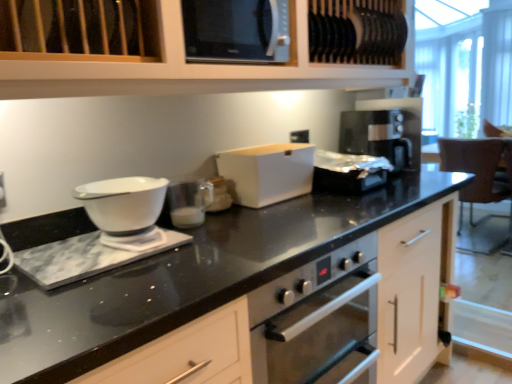
At what (x,y) coordinates should I click in order to perform the action: click on black glossy microwave at upper center. Please return your answer as a coordinate pair (x, y). The image size is (512, 384). Looking at the image, I should click on (236, 30).

Identify the location of silver metallic toaster at center, the 3th appliance viewed from the front. The width and height of the screenshot is (512, 384). (348, 172).

Measure the distance between white glossy bowl at left, which ranks as the second kitchen appliance in right-to-left order, and camera.

white glossy bowl at left, which ranks as the second kitchen appliance in right-to-left order, and camera are 1.06 meters apart from each other.

Find the location of a particular element. white glossy measuring cup at center, which is counted as the 1th appliance, starting from the left is located at coordinates (189, 203).

The height and width of the screenshot is (384, 512). I want to click on matte glass jar at center, positioned as the second appliance in front-to-back order, so click(219, 195).

Is brown leather chair at right directly adjacent to black glossy microwave at upper center?

brown leather chair at right is not next to black glossy microwave at upper center, and they're not touching.

From a real-world perspective, who is located higher, brown leather chair at right or black glossy microwave at upper center?

In real-world perspective, black glossy microwave at upper center is above.

Locate an element on the screen. The width and height of the screenshot is (512, 384). chair behind the black glossy microwave at upper center is located at coordinates (479, 176).

Between point (482, 162) and point (227, 54), which one is positioned behind?

The point (482, 162) is more distant.

Which of these two, silver metallic toaster at center, the 1th appliance from the back, or brown leather chair at right, is smaller?

silver metallic toaster at center, the 1th appliance from the back, is smaller.

From their relative heights in the image, would you say silver metallic toaster at center, the 3th appliance viewed from the front, is taller or shorter than brown leather chair at right?

In the image, silver metallic toaster at center, the 3th appliance viewed from the front, appears to be shorter than brown leather chair at right.

From the picture: From the image's perspective, is silver metallic toaster at center, which is the 1th appliance from right to left, positioned above or below brown leather chair at right?

Clearly, from the image's perspective, silver metallic toaster at center, which is the 1th appliance from right to left, is above brown leather chair at right.

From a real-world perspective, who is located lower, silver metallic toaster at center, which is the 1th appliance from right to left, or brown leather chair at right?

brown leather chair at right.

Is silver metallic toaster at center, the 3th appliance viewed from the front, positioned with its back to white matte breadbox at center, the second kitchen appliance from the left?

No, silver metallic toaster at center, the 3th appliance viewed from the front, is not facing the opposite direction of white matte breadbox at center, the second kitchen appliance from the left.

Can white matte breadbox at center, the second kitchen appliance from the left, be found inside silver metallic toaster at center, the 3th appliance viewed from the front?

No, silver metallic toaster at center, the 3th appliance viewed from the front, does not contain white matte breadbox at center, the second kitchen appliance from the left.

Considering the sizes of objects silver metallic toaster at center, which is the 1th appliance from right to left, and white matte breadbox at center, which ranks as the first kitchen appliance in right-to-left order, in the image provided, who is thinner, silver metallic toaster at center, which is the 1th appliance from right to left, or white matte breadbox at center, which ranks as the first kitchen appliance in right-to-left order,?

white matte breadbox at center, which ranks as the first kitchen appliance in right-to-left order, is thinner.

Is there a large distance between satin black coffee machine at right and silver metallic toaster at center, the 3th appliance viewed from the front?

No.

From a real-world perspective, which object rests below the other?

From a 3D spatial view, silver metallic toaster at center, the 1th appliance from the back, is below.

Between satin black coffee machine at right and silver metallic toaster at center, which is the 1th appliance from right to left, which one has smaller width?

silver metallic toaster at center, which is the 1th appliance from right to left, is thinner.

From the picture: In the image, is satin black coffee machine at right on the left side or the right side of white matte breadbox at center, acting as the 1th kitchen appliance starting from the back?

Based on their positions, satin black coffee machine at right is located to the right of white matte breadbox at center, acting as the 1th kitchen appliance starting from the back.

Is satin black coffee machine at right oriented away from white matte breadbox at center, the second kitchen appliance from the left?

satin black coffee machine at right does not have its back to white matte breadbox at center, the second kitchen appliance from the left.

Is satin black coffee machine at right far from white matte breadbox at center, acting as the 1th kitchen appliance starting from the back?

No, there isn't a large distance between satin black coffee machine at right and white matte breadbox at center, acting as the 1th kitchen appliance starting from the back.

From the picture: Does black glossy microwave at upper center appear on the right side of white glossy bowl at left, which is the second kitchen appliance from back to front?

Yes.

Consider the image. From a real-world perspective, which is physically below, black glossy microwave at upper center or white glossy bowl at left, the first kitchen appliance from the front?

white glossy bowl at left, the first kitchen appliance from the front, is physically lower.

The height and width of the screenshot is (384, 512). In order to click on the 1st kitchen appliance directly beneath the black glossy microwave at upper center (from a real-world perspective) in this screenshot , I will do `click(126, 210)`.

Is point (270, 39) behind point (92, 200)?

Yes.

Can you confirm if black glossy microwave at upper center is wider than white matte cabinet at upper center?

No, black glossy microwave at upper center is not wider than white matte cabinet at upper center.

Relative to white matte cabinet at upper center, is black glossy microwave at upper center in front or behind?

Clearly, black glossy microwave at upper center is behind white matte cabinet at upper center.

From the image's perspective, does black glossy microwave at upper center appear lower than white matte cabinet at upper center?

Yes, from the image's perspective, black glossy microwave at upper center is below white matte cabinet at upper center.

Is black glossy microwave at upper center not within white matte cabinet at upper center?

No, black glossy microwave at upper center is inside or overlapping with white matte cabinet at upper center.

Identify the location of microwave oven above the brown leather chair at right (from a real-world perspective). The height and width of the screenshot is (384, 512). (236, 30).

From the brown leather chair at right, count the 1st appliance to the left and point to it. Please provide its 2D coordinates.

[(348, 172)]

From the picture: When comparing their distances from white glossy measuring cup at center, the 3th appliance when ordered from right to left, does black glossy microwave at upper center or white glossy bowl at left, the first kitchen appliance from the front, seem closer?

white glossy bowl at left, the first kitchen appliance from the front, is positioned closer to the anchor white glossy measuring cup at center, the 3th appliance when ordered from right to left.

Consider the image. Which object lies further to the anchor point brown leather chair at right, white glossy measuring cup at center, which is counted as the 1th appliance, starting from the left, or white matte breadbox at center, acting as the 1th kitchen appliance starting from the back?

white glossy measuring cup at center, which is counted as the 1th appliance, starting from the left.

When comparing their distances from brown leather chair at right, does white glossy bowl at left, which is the second kitchen appliance from back to front, or black glossy microwave at upper center seem further?

The object further to brown leather chair at right is white glossy bowl at left, which is the second kitchen appliance from back to front.

When comparing their distances from white matte cabinet at upper center, does white glossy bowl at left, which ranks as the second kitchen appliance in right-to-left order, or matte glass jar at center, which appears as the second appliance when viewed from the right, seem closer?

Based on the image, white glossy bowl at left, which ranks as the second kitchen appliance in right-to-left order, appears to be nearer to white matte cabinet at upper center.

From the image, which object appears to be nearer to satin black coffee machine at right, silver metallic toaster at center, positioned as the third appliance in left-to-right order, or white matte cabinet at upper center?

silver metallic toaster at center, positioned as the third appliance in left-to-right order, is positioned closer to the anchor satin black coffee machine at right.

Estimate the real-world distances between objects in this image. Which object is further from satin black coffee machine at right, white glossy measuring cup at center, which is counted as the 1th appliance, starting from the left, or black glossy microwave at upper center?

white glossy measuring cup at center, which is counted as the 1th appliance, starting from the left, lies further to satin black coffee machine at right than the other object.

When comparing their distances from matte glass jar at center, positioned as the second appliance in front-to-back order, does white glossy measuring cup at center, the 3th appliance when ordered from right to left, or brown leather chair at right seem closer?

Among the two, white glossy measuring cup at center, the 3th appliance when ordered from right to left, is located nearer to matte glass jar at center, positioned as the second appliance in front-to-back order.

Based on their spatial positions, is black glossy microwave at upper center or satin black coffee machine at right further from white glossy bowl at left, the first kitchen appliance from the front?

satin black coffee machine at right is further to white glossy bowl at left, the first kitchen appliance from the front.

You are a GUI agent. You are given a task and a screenshot of the screen. Output one action in this format:
    pyautogui.click(x=<x>, y=<y>)
    Task: Click on the appliance between white glossy bowl at left, which is the first kitchen appliance from left to right, and matte glass jar at center, which ranks as the second appliance in left-to-right order, along the z-axis
    
    Given the screenshot: What is the action you would take?
    pyautogui.click(x=189, y=203)

Locate an element on the screen. kitchen appliance located between white glossy measuring cup at center, which is the 1th appliance in front-to-back order, and satin black coffee machine at right in the left-right direction is located at coordinates (267, 172).

At what (x,y) coordinates should I click in order to perform the action: click on appliance between white matte breadbox at center, which ranks as the first kitchen appliance in right-to-left order, and brown leather chair at right. Please return your answer as a coordinate pair (x, y). The width and height of the screenshot is (512, 384). Looking at the image, I should click on (348, 172).

Locate an element on the screen. appliance between white glossy measuring cup at center, which is counted as the 1th appliance, starting from the left, and white matte breadbox at center, acting as the 1th kitchen appliance starting from the back, from left to right is located at coordinates (219, 195).